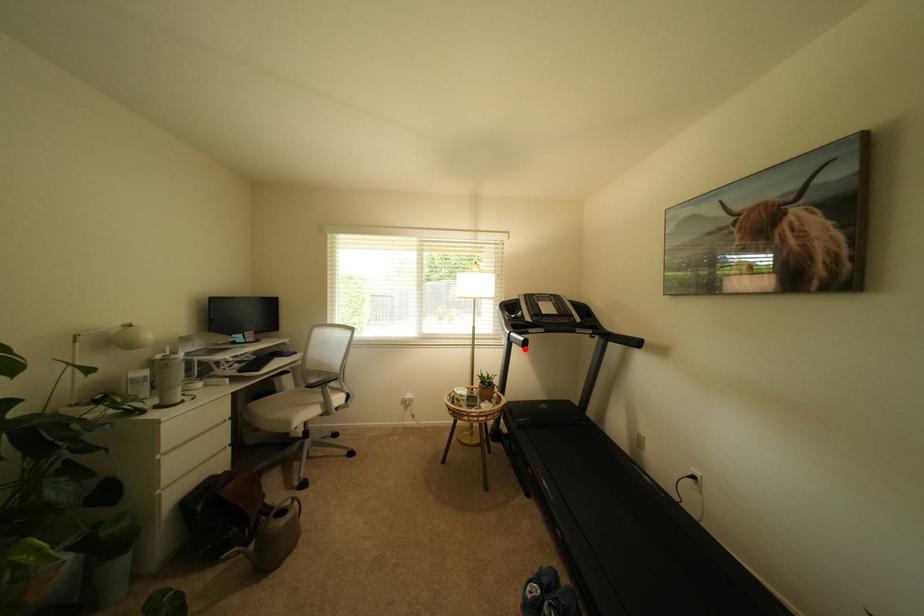
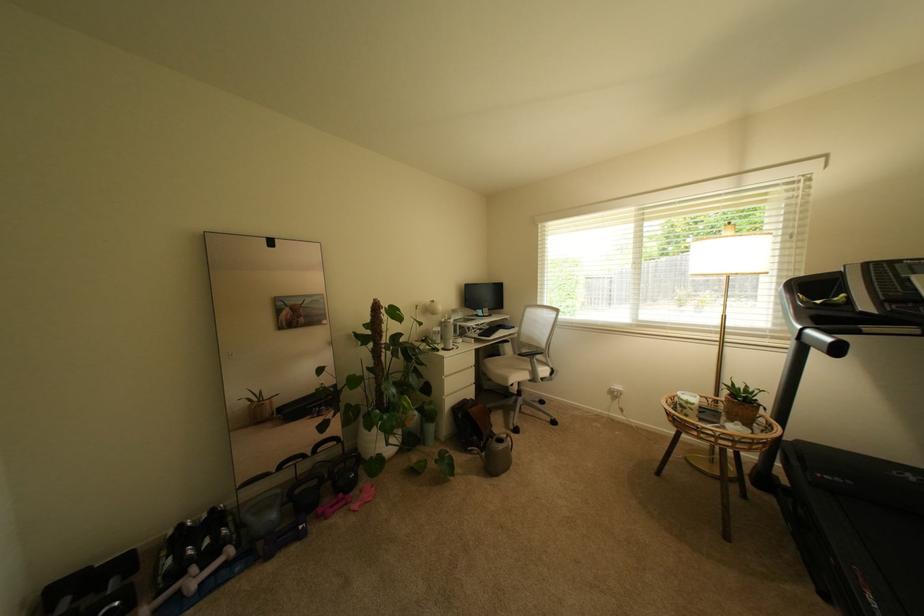
Find the pixel in the second image that matches the highlighted location in the first image.

(824, 355)